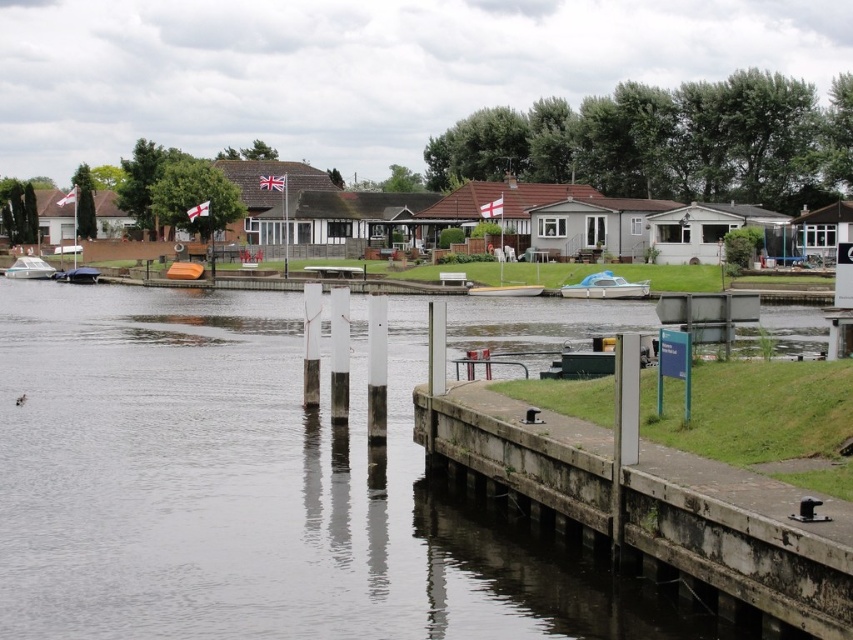
Does point (709, 568) come closer to viewer compared to point (39, 268)?

Yes, it is.

Which is behind, point (521, 436) or point (26, 269)?

The point (26, 269) is behind.

Where is `concrete dock at lower right`? The image size is (853, 640). concrete dock at lower right is located at coordinates (738, 544).

You are a GUI agent. You are given a task and a screenshot of the screen. Output one action in this format:
    pyautogui.click(x=<x>, y=<y>)
    Task: Click on the concrete dock at lower right
    
    Given the screenshot: What is the action you would take?
    pyautogui.click(x=738, y=544)

Can you confirm if white glossy boat at lower left is positioned to the left of orange matte boat at center?

Yes, white glossy boat at lower left is to the left of orange matte boat at center.

Consider the image. Can you confirm if white glossy boat at lower left is wider than orange matte boat at center?

Correct, the width of white glossy boat at lower left exceeds that of orange matte boat at center.

This screenshot has height=640, width=853. Identify the location of white glossy boat at lower left. (28, 268).

Between concrete dock at lower right and orange matte boat at center, which one appears on the left side from the viewer's perspective?

orange matte boat at center is more to the left.

Looking at this image, can you confirm if concrete dock at lower right is positioned to the right of orange matte boat at center?

Correct, you'll find concrete dock at lower right to the right of orange matte boat at center.

Where is `concrete dock at lower right`? The image size is (853, 640). concrete dock at lower right is located at coordinates (738, 544).